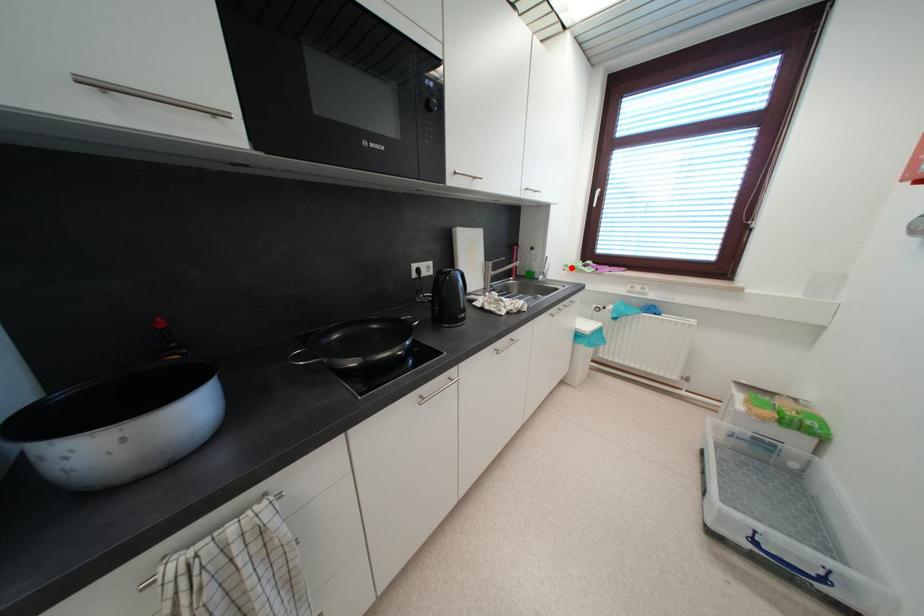
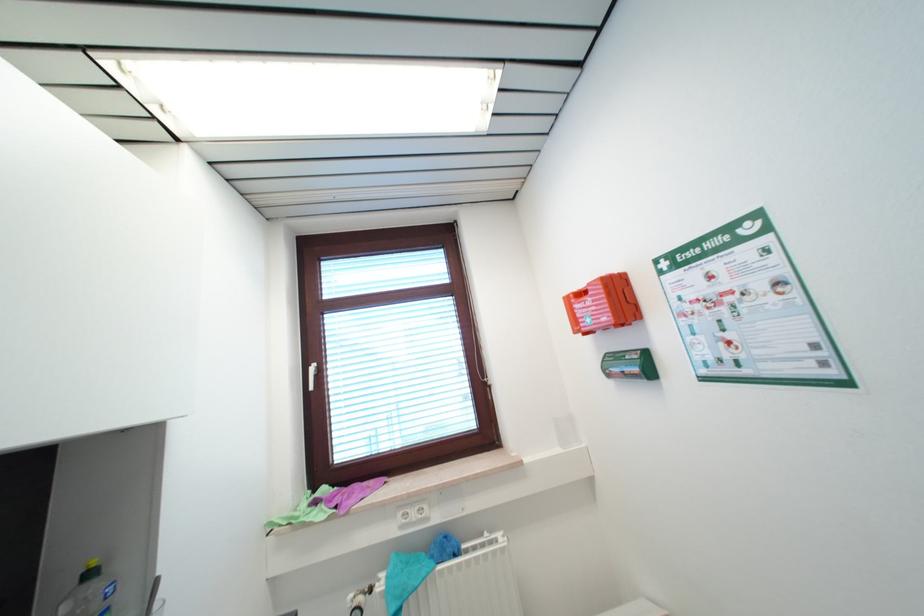
Locate, in the second image, the point that corresponds to the highlighted location in the first image.

(274, 525)